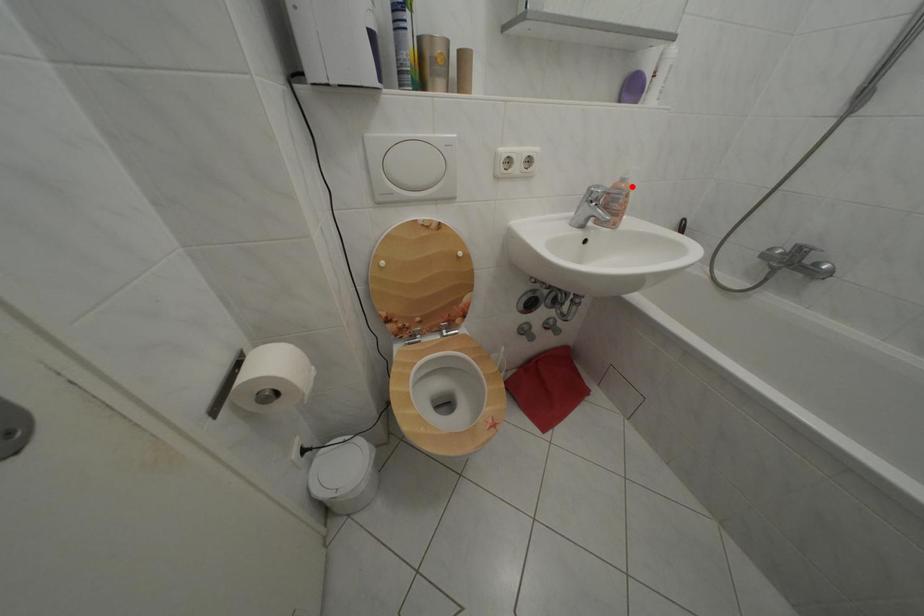
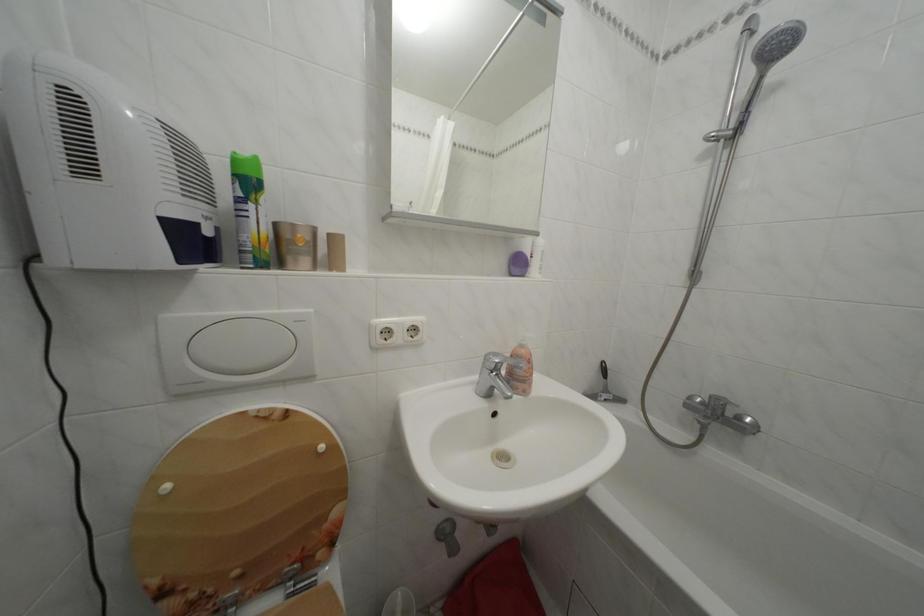
Find the pixel in the second image that matches the highlighted location in the first image.

(530, 352)